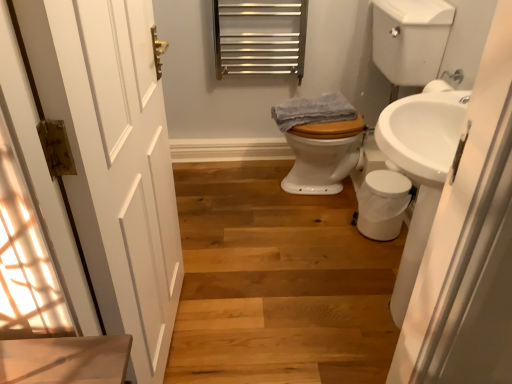
Question: From a real-world perspective, is white glossy sink at right positioned above or below gray cotton towel at center?

Choices:
 (A) above
 (B) below

Answer: (B)

Question: Considering the positions of white glossy sink at right and gray cotton towel at center in the image, is white glossy sink at right wider or thinner than gray cotton towel at center?

Choices:
 (A) thin
 (B) wide

Answer: (A)

Question: Which object is the farthest from the wooden stairs at lower left?

Choices:
 (A) gray cotton towel at center
 (B) white wooden door at left
 (C) white glossy toilet at center
 (D) white glossy sink at right

Answer: (D)

Question: Based on their relative distances, which object is nearer to the white glossy sink at right?

Choices:
 (A) white glossy toilet at center
 (B) white wooden door at left
 (C) gray cotton towel at center
 (D) wooden stairs at lower left

Answer: (B)